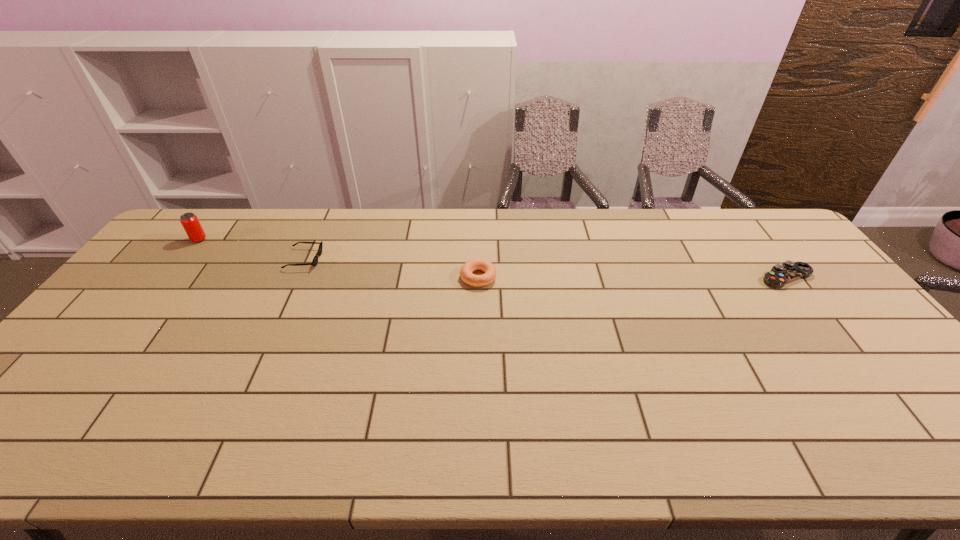
The image size is (960, 540). In order to click on can in this screenshot , I will do `click(189, 221)`.

This screenshot has width=960, height=540. Find the location of `the leftmost object`. the leftmost object is located at coordinates (189, 221).

You are a GUI agent. You are given a task and a screenshot of the screen. Output one action in this format:
    pyautogui.click(x=<x>, y=<y>)
    Task: Click on the third object from left to right
    This screenshot has width=960, height=540.
    Given the screenshot: What is the action you would take?
    pyautogui.click(x=468, y=277)

Image resolution: width=960 pixels, height=540 pixels. I want to click on control, so click(x=779, y=275).

You are a GUI agent. You are given a task and a screenshot of the screen. Output one action in this format:
    pyautogui.click(x=<x>, y=<y>)
    Task: Click on the third object from right to left
    This screenshot has width=960, height=540.
    Given the screenshot: What is the action you would take?
    pyautogui.click(x=315, y=260)

Where is `sunglasses`? sunglasses is located at coordinates (315, 260).

The image size is (960, 540). In order to click on vacant space situated on the right of the can in this screenshot , I will do `click(321, 240)`.

Where is `vacant space located 0.270m on the front of the bagel`? This screenshot has height=540, width=960. vacant space located 0.270m on the front of the bagel is located at coordinates (478, 362).

Identify the location of free region located 0.210m on the back of the control. The width and height of the screenshot is (960, 540). (748, 228).

The image size is (960, 540). I want to click on vacant area situated 0.130m on the front-facing side of the shortest object, so click(360, 259).